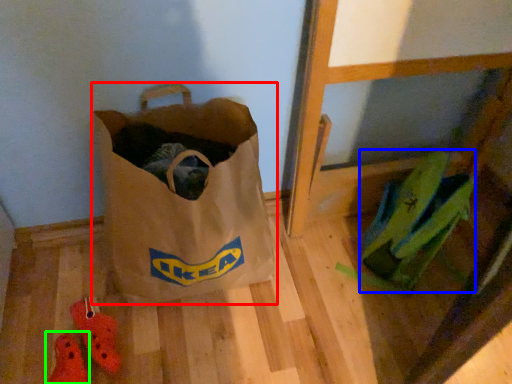
Question: Estimate the real-world distances between objects in this image. Which object is farther from luggage and bags (highlighted by a red box), grocery bag (highlighted by a blue box) or footwear (highlighted by a green box)?

Choices:
 (A) grocery bag
 (B) footwear

Answer: (A)